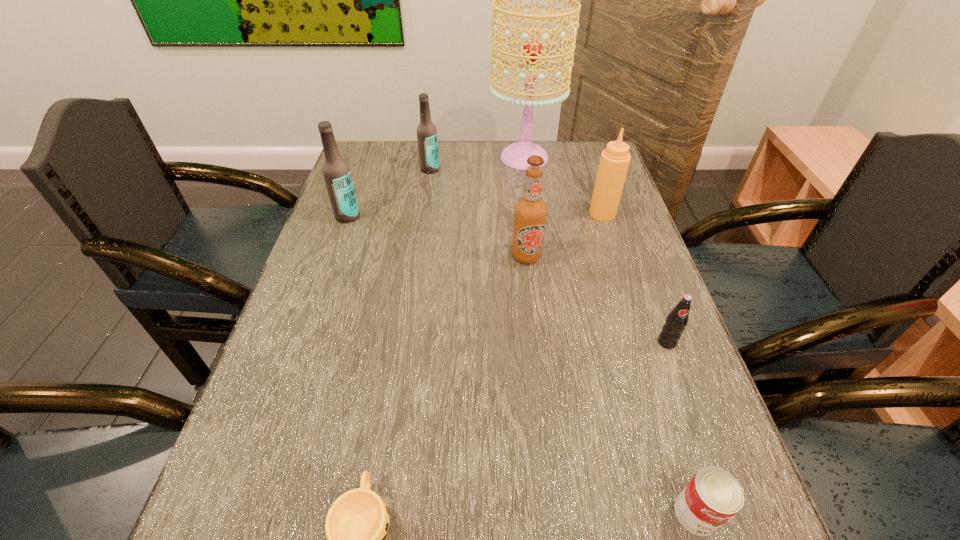
Locate an element on the screen. The image size is (960, 540). object that is the third closest one to the shortest object is located at coordinates (677, 320).

Choose which beer bottle is the nearest neighbor to the second shortest object. Please provide its 2D coordinates. Your answer should be formatted as a tuple, i.e. [(x, y)], where the tuple contains the x and y coordinates of a point satisfying the conditions above.

[(530, 211)]

Find the location of `beer bottle identified as the closest to the cup`. beer bottle identified as the closest to the cup is located at coordinates [530, 211].